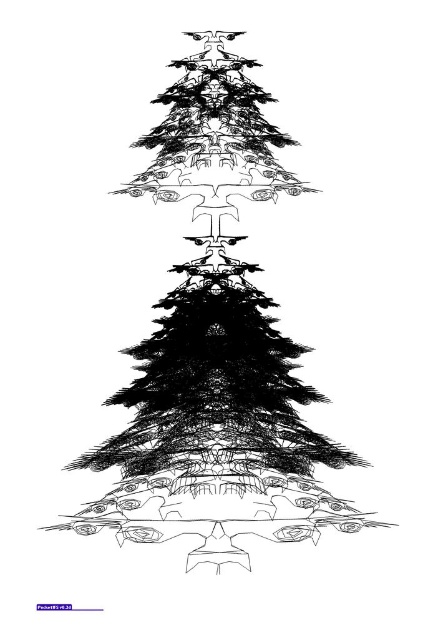
You are an artist trying to recreate the Christmas tree from the image. You notice that the black ink drawing of christmas tree at center and the smooth textured base at center have different thicknesses. Which one has a thinner appearance?

The black ink drawing of christmas tree at center is thinner than the smooth textured base at center.

You are an artist who wants to add a new decoration to the black ink drawing of christmas tree at center. Since the smooth textured base at center is already present, where should you place the decoration to ensure it stays on the tree?

The black ink drawing of christmas tree at center is positioned over the smooth textured base at center, so placing the decoration on the tree itself will ensure it stays on the tree and not on the base.